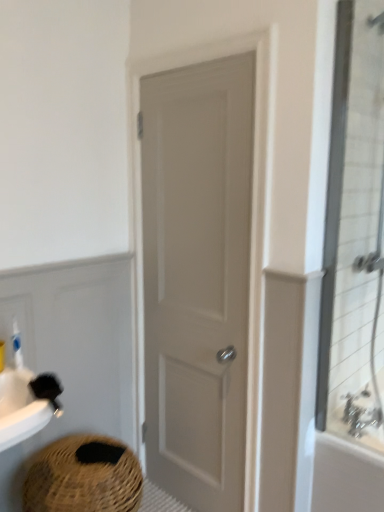
Question: From the image's perspective, is silver metallic faucet at upper right located above braided straw basket at lower left?

Choices:
 (A) yes
 (B) no

Answer: (A)

Question: Can you confirm if silver metallic faucet at upper right is shorter than braided straw basket at lower left?

Choices:
 (A) yes
 (B) no

Answer: (A)

Question: From a real-world perspective, is silver metallic faucet at upper right on top of braided straw basket at lower left?

Choices:
 (A) yes
 (B) no

Answer: (A)

Question: Can you confirm if silver metallic faucet at upper right is thinner than braided straw basket at lower left?

Choices:
 (A) yes
 (B) no

Answer: (A)

Question: From a real-world perspective, is silver metallic faucet at upper right located beneath braided straw basket at lower left?

Choices:
 (A) no
 (B) yes

Answer: (A)

Question: From a real-world perspective, is silver metallic faucet at upper right positioned above or below white plastic bottle at left?

Choices:
 (A) below
 (B) above

Answer: (A)

Question: Based on their sizes in the image, would you say silver metallic faucet at upper right is bigger or smaller than white plastic bottle at left?

Choices:
 (A) big
 (B) small

Answer: (A)

Question: Visually, is silver metallic faucet at upper right positioned to the left or to the right of white plastic bottle at left?

Choices:
 (A) left
 (B) right

Answer: (B)

Question: Is silver metallic faucet at upper right inside or outside of white plastic bottle at left?

Choices:
 (A) inside
 (B) outside

Answer: (B)

Question: Does point (369, 118) appear closer or farther from the camera than point (355, 394)?

Choices:
 (A) closer
 (B) farther

Answer: (A)

Question: In terms of width, does clear glass shower door at right look wider or thinner when compared to silver metallic faucet at upper right?

Choices:
 (A) thin
 (B) wide

Answer: (B)

Question: From their relative heights in the image, would you say clear glass shower door at right is taller or shorter than silver metallic faucet at upper right?

Choices:
 (A) tall
 (B) short

Answer: (A)

Question: Considering their positions, is clear glass shower door at right located in front of or behind silver metallic faucet at upper right?

Choices:
 (A) front
 (B) behind

Answer: (A)

Question: Is silver metallic faucet at upper right taller or shorter than clear glass shower door at right?

Choices:
 (A) short
 (B) tall

Answer: (A)

Question: Considering their positions, is silver metallic faucet at upper right located in front of or behind clear glass shower door at right?

Choices:
 (A) front
 (B) behind

Answer: (B)